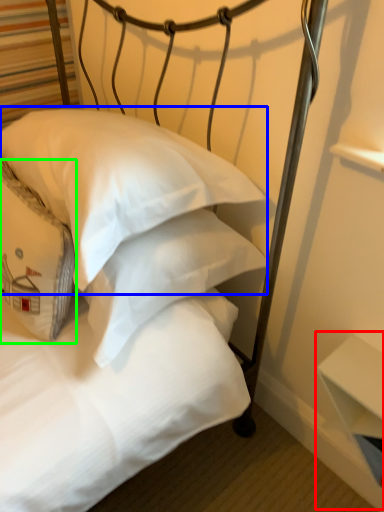
Question: Which is nearer to the table (highlighted by a red box)? pillow (highlighted by a blue box) or pillow (highlighted by a green box).

Choices:
 (A) pillow
 (B) pillow

Answer: (A)